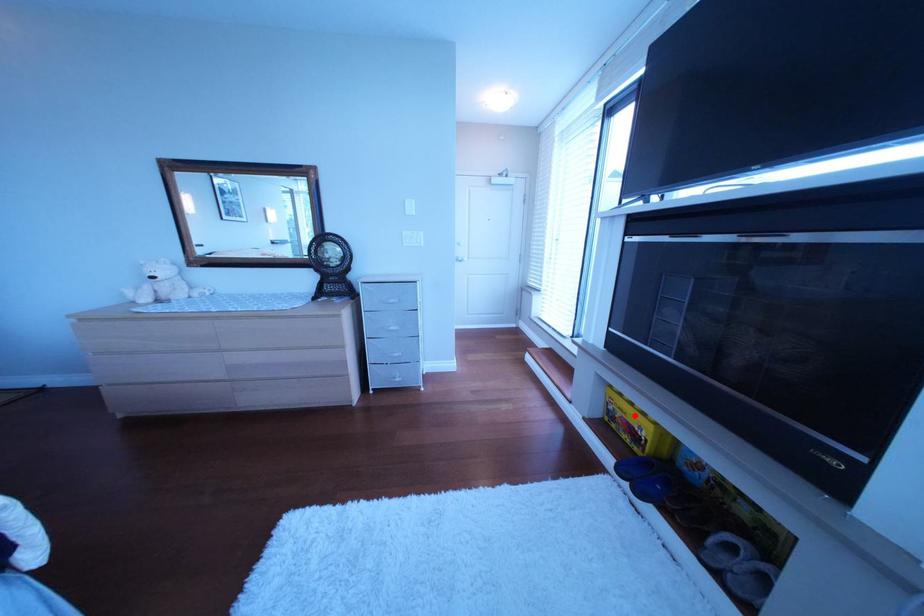
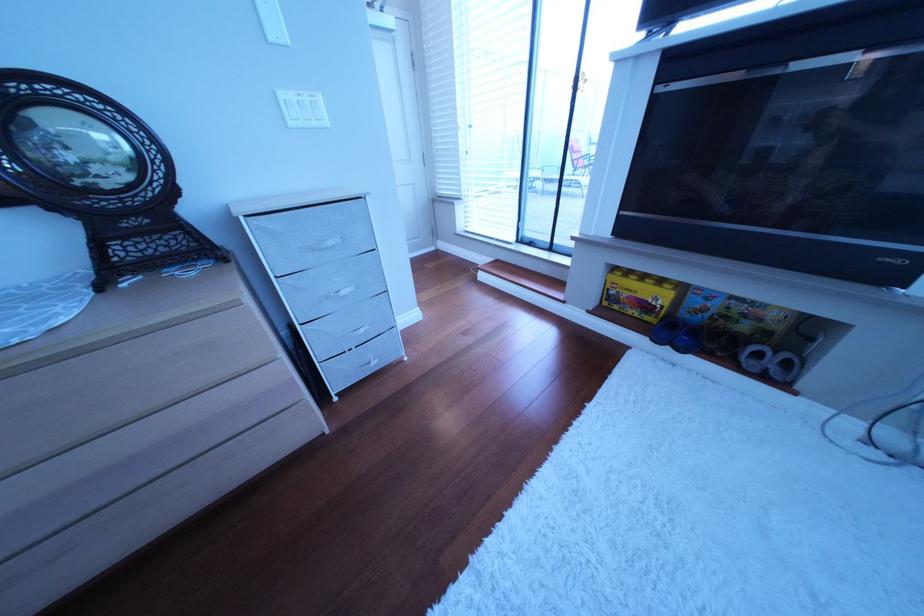
Question: I am providing you with two images of the same scene from different viewpoints. Given a red point in image1, look at the same physical point in image2. Is it:

Choices:
 (A) Closer to the viewpoint
 (B) Farther from the viewpoint

Answer: (A)